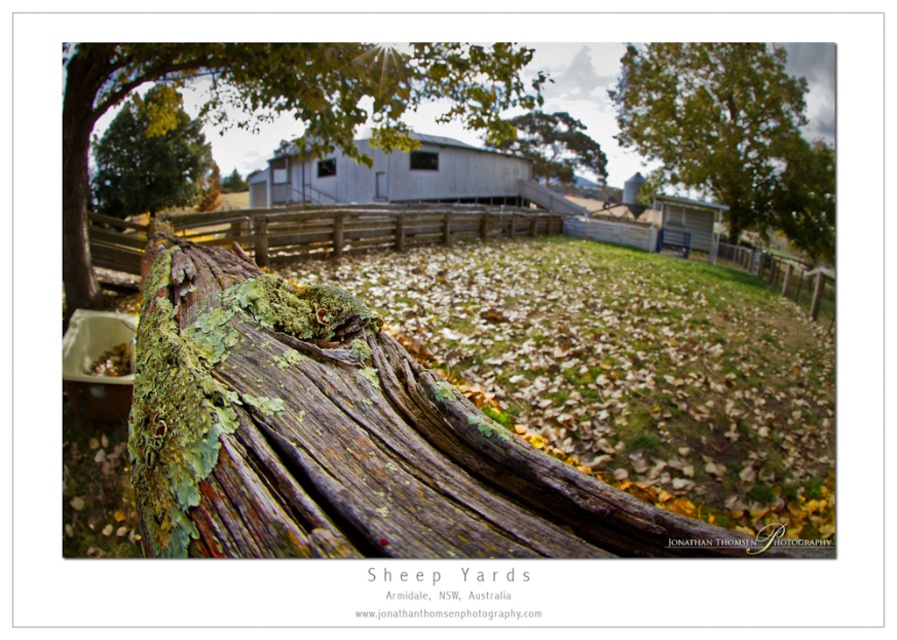
Question: Which is farther from the green mossy wood at center?

Choices:
 (A) green mossy wood at upper center
 (B) green mossy wood at left

Answer: (A)

Question: Which point appears farthest from the camera in this image?

Choices:
 (A) (580, 124)
 (B) (140, 230)
 (C) (686, 176)

Answer: (A)

Question: Considering the relative positions of green mossy wood at left and green mossy wood at upper left in the image provided, where is green mossy wood at left located with respect to green mossy wood at upper left?

Choices:
 (A) right
 (B) left

Answer: (A)

Question: Does green mossy wood at left appear on the right side of gray metallic barn at center?

Choices:
 (A) yes
 (B) no

Answer: (A)

Question: Which point appears closest to the camera in this image?

Choices:
 (A) (429, 227)
 (B) (147, 112)
 (C) (408, 152)
 (D) (203, 512)

Answer: (D)

Question: Is green mossy wood at center to the right of weathered wood fence at center from the viewer's perspective?

Choices:
 (A) yes
 (B) no

Answer: (B)